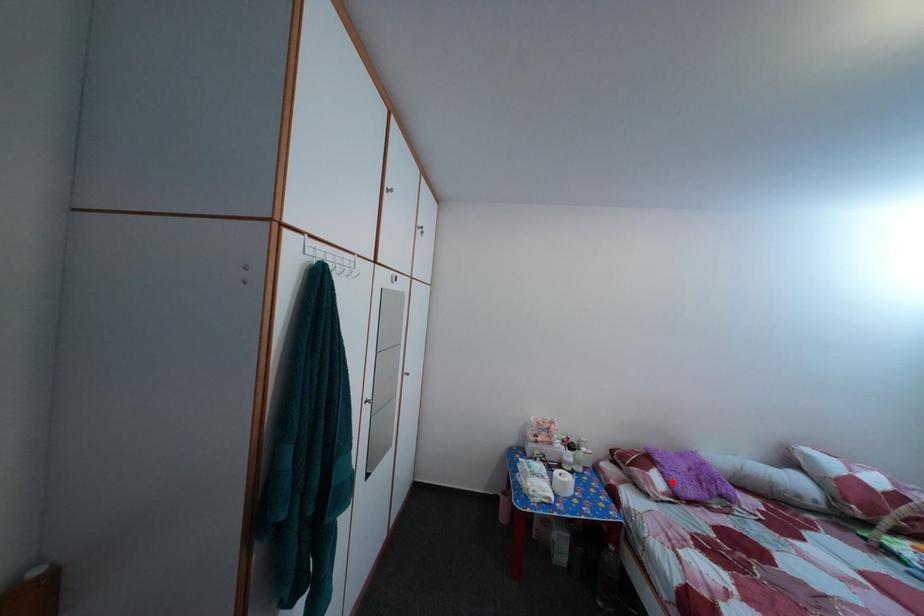
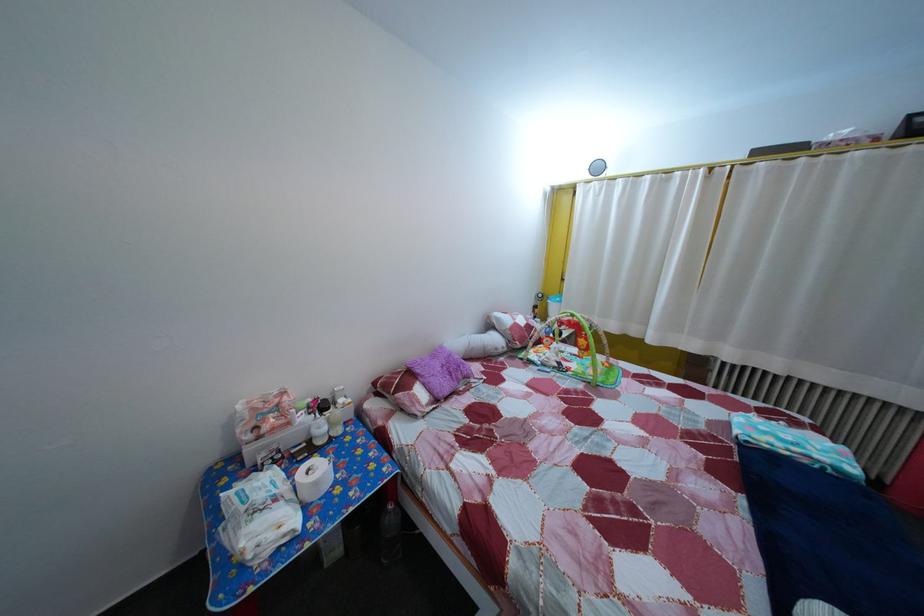
Question: I am providing you with two images of the same scene from different viewpoints. A red point is marked on the first image. Can you still see the location of the red point in image 2?

Choices:
 (A) Yes
 (B) No

Answer: (A)